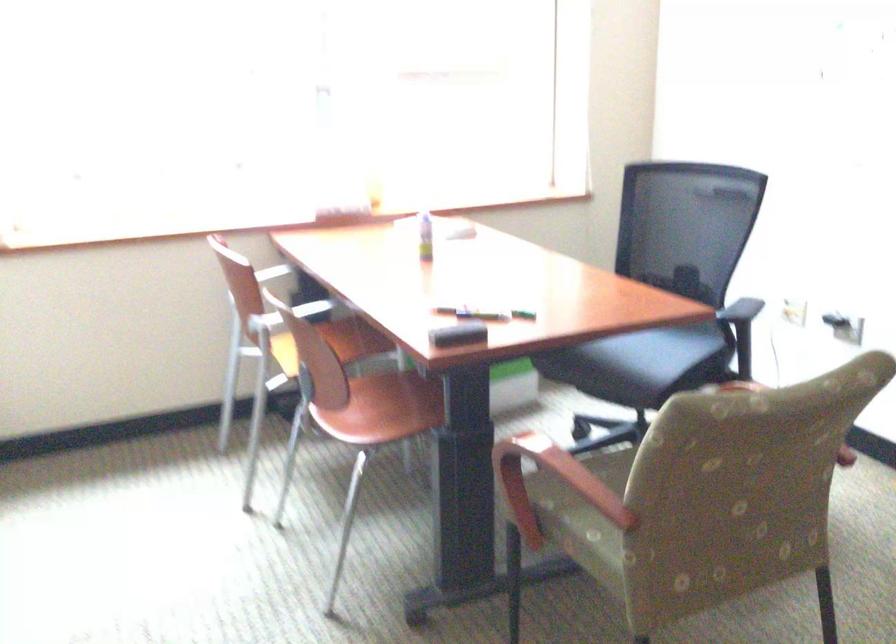
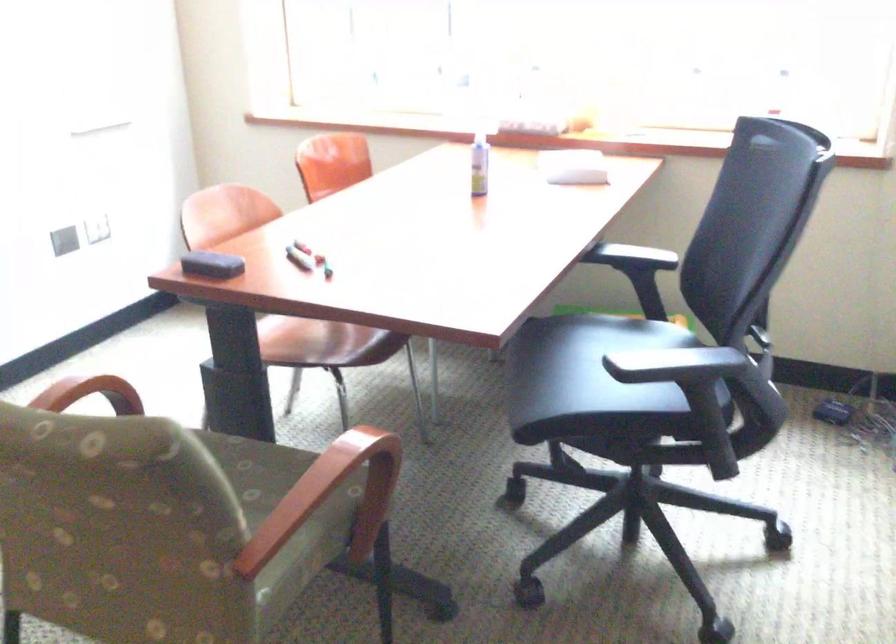
In the second image, find the point that corresponds to pixel 531 451 in the first image.

(90, 393)